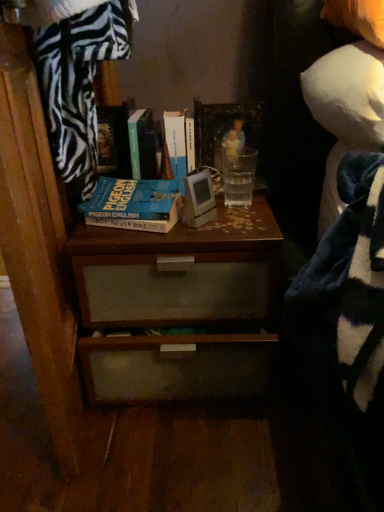
Question: Considering the relative positions of wooden picture frame at center and blue matte book at center, positioned as the 1th book in left-to-right order, in the image provided, is wooden picture frame at center to the right of blue matte book at center, positioned as the 1th book in left-to-right order, from the viewer's perspective?

Choices:
 (A) yes
 (B) no

Answer: (A)

Question: From the image's perspective, is wooden picture frame at center on top of blue matte book at center, placed as the third book when sorted from right to left?

Choices:
 (A) no
 (B) yes

Answer: (B)

Question: From the image's perspective, is wooden picture frame at center located beneath blue matte book at center, placed as the third book when sorted from right to left?

Choices:
 (A) yes
 (B) no

Answer: (B)

Question: Is wooden picture frame at center in contact with blue matte book at center, placed as the third book when sorted from right to left?

Choices:
 (A) yes
 (B) no

Answer: (B)

Question: Is wooden picture frame at center not within blue matte book at center, placed as the third book when sorted from right to left?

Choices:
 (A) yes
 (B) no

Answer: (A)

Question: From the image's perspective, is wooden picture frame at center located above or below green matte book at upper center, arranged as the 2th book when viewed from the left?

Choices:
 (A) above
 (B) below

Answer: (B)

Question: Is wooden picture frame at center inside the boundaries of green matte book at upper center, arranged as the 2th book when viewed from the left, or outside?

Choices:
 (A) inside
 (B) outside

Answer: (B)

Question: Considering the positions of wooden picture frame at center and green matte book at upper center, arranged as the 2th book when viewed from the left, in the image, is wooden picture frame at center taller or shorter than green matte book at upper center, arranged as the 2th book when viewed from the left,?

Choices:
 (A) tall
 (B) short

Answer: (A)

Question: Looking at the image, does wooden picture frame at center seem bigger or smaller compared to green matte book at upper center, which is counted as the second book, starting from the right?

Choices:
 (A) small
 (B) big

Answer: (A)

Question: Considering the positions of point coord(145,144) and point coord(178,131), is point coord(145,144) closer or farther from the camera than point coord(178,131)?

Choices:
 (A) closer
 (B) farther

Answer: (A)

Question: In the image, is green matte book at upper center, which is counted as the second book, starting from the right, positioned in front of or behind hardcover book at center, the 1th book positioned from the right?

Choices:
 (A) front
 (B) behind

Answer: (A)

Question: From the image's perspective, is green matte book at upper center, which is counted as the second book, starting from the right, above or below hardcover book at center, the 1th book positioned from the right?

Choices:
 (A) above
 (B) below

Answer: (B)

Question: From their relative heights in the image, would you say green matte book at upper center, which is counted as the second book, starting from the right, is taller or shorter than hardcover book at center, the 1th book positioned from the right?

Choices:
 (A) short
 (B) tall

Answer: (B)

Question: Is white fabric doll at upper right inside the boundaries of brown wood chest of drawers at center, or outside?

Choices:
 (A) outside
 (B) inside

Answer: (A)

Question: Considering the positions of white fabric doll at upper right and brown wood chest of drawers at center in the image, is white fabric doll at upper right bigger or smaller than brown wood chest of drawers at center?

Choices:
 (A) small
 (B) big

Answer: (A)